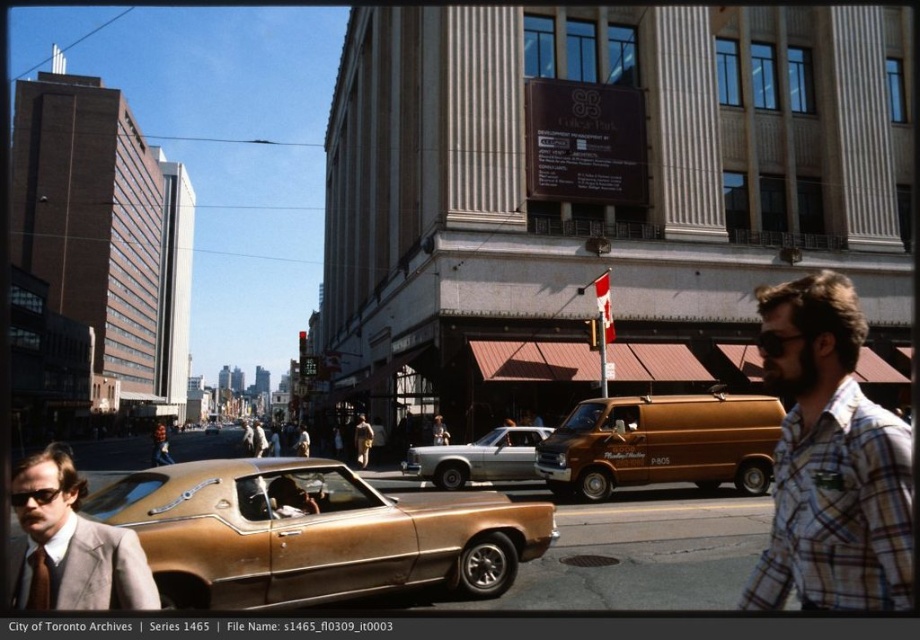
Is gold metallic car at center smaller than plaid cotton shirt at right?

Indeed, gold metallic car at center has a smaller size compared to plaid cotton shirt at right.

How much distance is there between gold metallic car at center and plaid cotton shirt at right?

They are 14.64 meters apart.

Who is more distant from viewer, (462, 525) or (788, 468)?

The point (462, 525) is behind.

At what (x,y) coordinates should I click in order to perform the action: click on gold metallic car at center. Please return your answer as a coordinate pair (x, y). This screenshot has height=640, width=920. Looking at the image, I should click on (314, 532).

Based on the photo, which is more to the left, plaid cotton shirt at right or black plastic goggles at center?

Positioned to the left is black plastic goggles at center.

Consider the image. Between plaid cotton shirt at right and black plastic goggles at center, which one is positioned higher?

Positioned higher is black plastic goggles at center.

Between point (886, 572) and point (782, 330), which one is positioned in front?

Positioned in front is point (886, 572).

Locate an element on the screen. Image resolution: width=920 pixels, height=640 pixels. plaid cotton shirt at right is located at coordinates (832, 465).

Does gold metallic car at center have a smaller size compared to silver metallic sedan at center?

No, gold metallic car at center is not smaller than silver metallic sedan at center.

Can you confirm if gold metallic car at center is positioned to the right of silver metallic sedan at center?

Incorrect, gold metallic car at center is not on the right side of silver metallic sedan at center.

The height and width of the screenshot is (640, 920). I want to click on gold metallic car at center, so click(x=314, y=532).